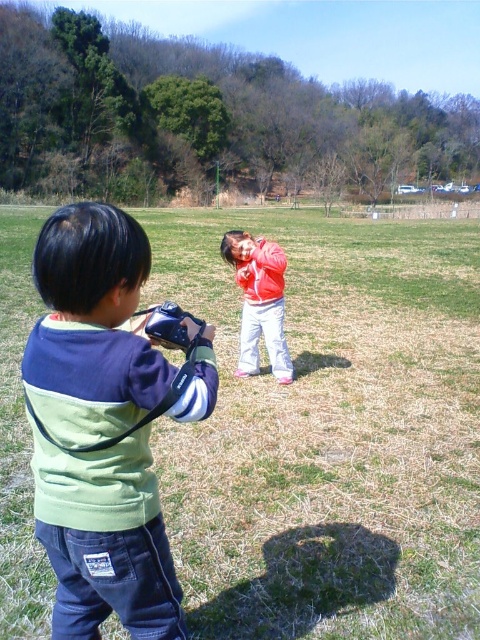
Question: Does matte blue-green hoodie at left have a greater width compared to matte red jacket at center?

Choices:
 (A) yes
 (B) no

Answer: (A)

Question: Is matte blue-green hoodie at left in front of matte red jacket at center?

Choices:
 (A) yes
 (B) no

Answer: (A)

Question: Which point is farther to the camera?

Choices:
 (A) matte red jacket at center
 (B) green grass at center

Answer: (A)

Question: Which object is closer to the camera taking this photo?

Choices:
 (A) matte red jacket at center
 (B) matte blue-green hoodie at left
 (C) green grass at center

Answer: (B)

Question: Is matte blue-green hoodie at left wider than matte red jacket at center?

Choices:
 (A) no
 (B) yes

Answer: (B)

Question: Which of the following is the closest to the observer?

Choices:
 (A) (349, 458)
 (B) (96, 586)
 (C) (243, 301)

Answer: (B)